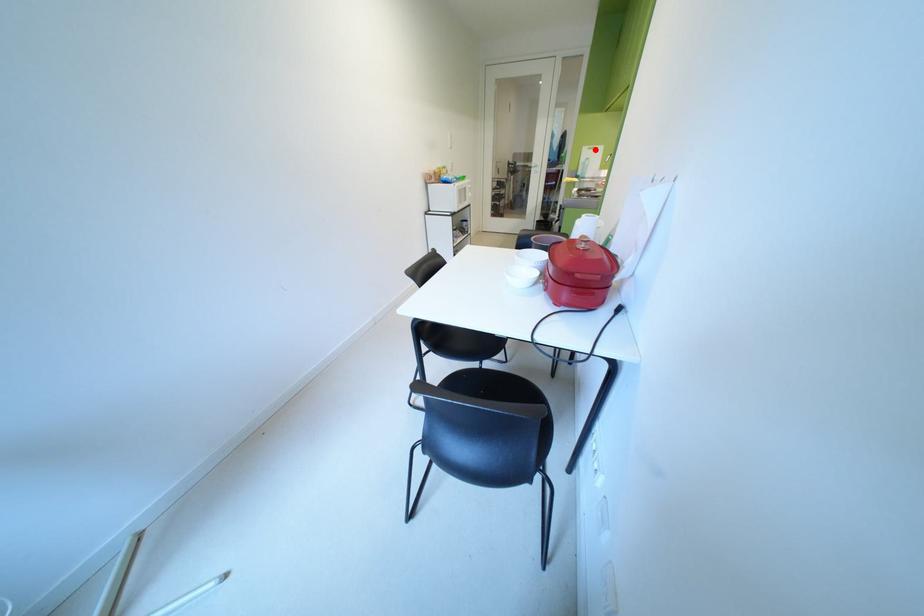
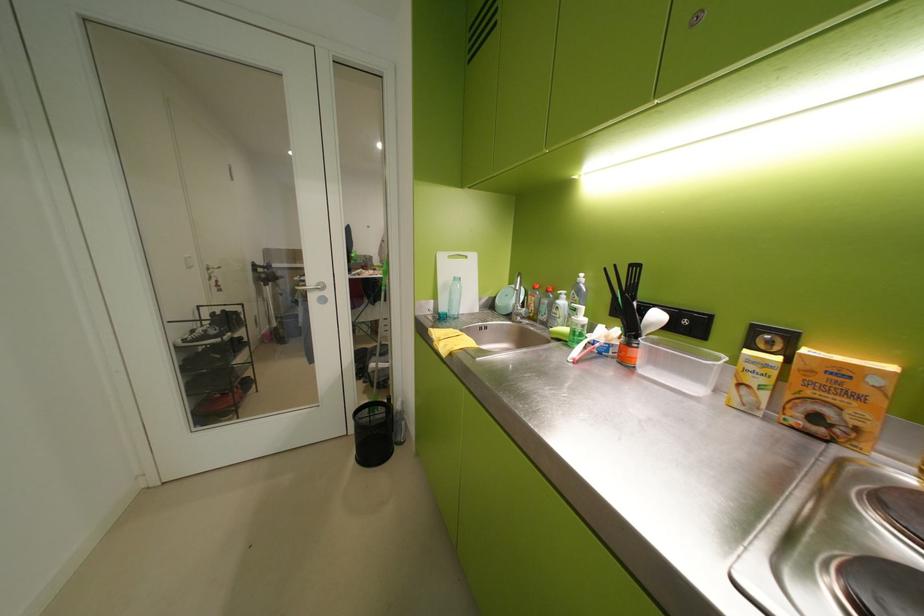
The point at the highlighted location is marked in the first image. Where is the corresponding point in the second image?

(453, 259)